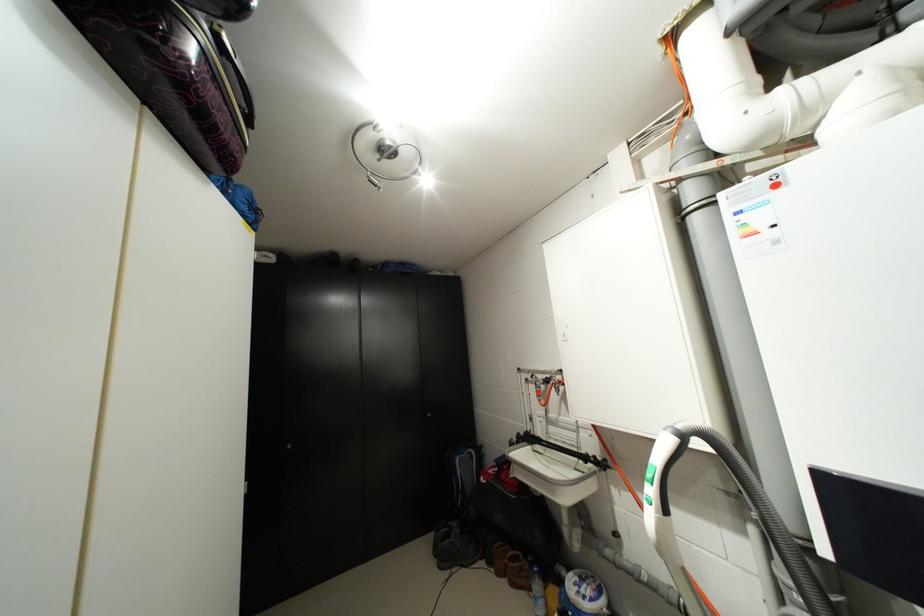
Where would you grip the vacuum cleaner handle? Please return your answer as a coordinate pair (x, y).

(661, 480)